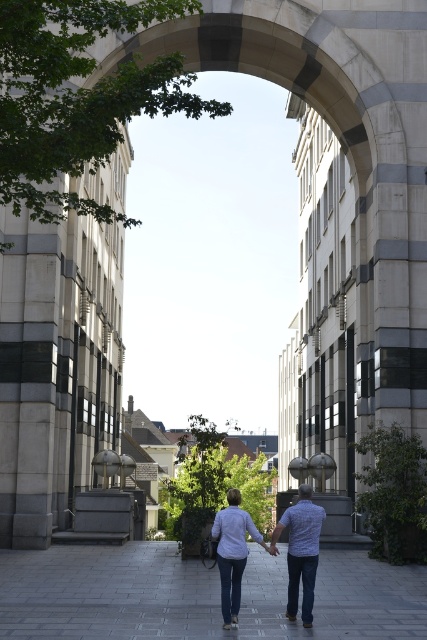
Is light blue denim jeans at center further to camera compared to plaid shirt at center?

No, light blue denim jeans at center is closer to the viewer.

What do you see at coordinates (300, 550) in the screenshot?
I see `light blue denim jeans at center` at bounding box center [300, 550].

At what (x,y) coordinates should I click in order to perform the action: click on light blue denim jeans at center. Please return your answer as a coordinate pair (x, y). This screenshot has width=427, height=640. Looking at the image, I should click on (300, 550).

Does gray concrete pavement at center appear over light blue denim jeans at center?

Actually, gray concrete pavement at center is below light blue denim jeans at center.

Who is higher up, gray concrete pavement at center or light blue denim jeans at center?

Positioned higher is light blue denim jeans at center.

Is point (357, 589) in front of point (298, 512)?

No, (357, 589) is behind (298, 512).

This screenshot has height=640, width=427. Identify the location of gray concrete pavement at center. (198, 595).

Does gray concrete pavement at center have a smaller size compared to plaid shirt at center?

No.

The height and width of the screenshot is (640, 427). Describe the element at coordinates (198, 595) in the screenshot. I see `gray concrete pavement at center` at that location.

Identify the location of gray concrete pavement at center. This screenshot has height=640, width=427. (198, 595).